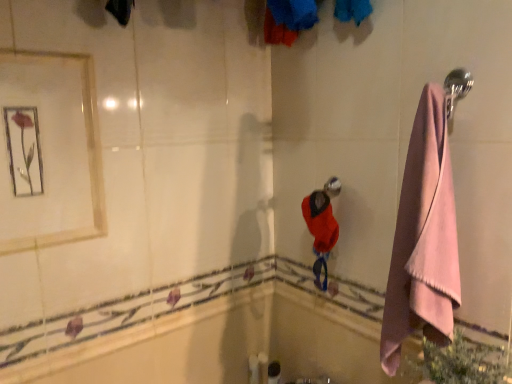
Identify the location of metallic framed mirror at upper left. Image resolution: width=512 pixels, height=384 pixels. point(49,151).

What do you see at coordinates (227, 344) in the screenshot?
I see `white glossy bath at lower left` at bounding box center [227, 344].

At what (x,y) coordinates should I click in order to perform the action: click on metallic framed mirror at upper left. Please return your answer as a coordinate pair (x, y). Looking at the image, I should click on (49, 151).

How distant is satin silver shower head at center from pink fabric towel at right?

They are 16.83 inches apart.

Is satin silver shower head at center bigger or smaller than pink fabric towel at right?

In the image, satin silver shower head at center appears to be smaller than pink fabric towel at right.

This screenshot has height=384, width=512. I want to click on shower behind the pink fabric towel at right, so tap(332, 187).

What's the angular difference between satin silver shower head at center and pink fabric towel at right's facing directions?

The angle between the facing direction of satin silver shower head at center and the facing direction of pink fabric towel at right is 0.546 degrees.

Which object is further away from the camera, metallic framed mirror at upper left or white glossy bath at lower left?

Positioned behind is white glossy bath at lower left.

Is metallic framed mirror at upper left oriented towards white glossy bath at lower left?

No, metallic framed mirror at upper left is not oriented towards white glossy bath at lower left.

Between metallic framed mirror at upper left and white glossy bath at lower left, which one has smaller width?

white glossy bath at lower left is thinner.

From the picture: Considering the relative positions of white glossy bath at lower left and metallic framed mirror at upper left in the image provided, is white glossy bath at lower left to the left of metallic framed mirror at upper left from the viewer's perspective?

No.

Considering the positions of points (230, 362) and (65, 131), is point (230, 362) farther from camera compared to point (65, 131)?

Yes, it is.

Is white glossy bath at lower left shorter than metallic framed mirror at upper left?

Yes.

From a real-world perspective, between white glossy bath at lower left and metallic framed mirror at upper left, who is vertically lower?

From a 3D spatial view, white glossy bath at lower left is below.

Based on the photo, can you see pink fabric towel at right touching metallic framed mirror at upper left?

pink fabric towel at right and metallic framed mirror at upper left are not in contact.

Considering the sizes of objects pink fabric towel at right and metallic framed mirror at upper left in the image provided, who is smaller, pink fabric towel at right or metallic framed mirror at upper left?

metallic framed mirror at upper left is smaller.

Is pink fabric towel at right inside or outside of metallic framed mirror at upper left?

pink fabric towel at right cannot be found inside metallic framed mirror at upper left.

Considering the sizes of satin silver shower head at center and white glossy bath at lower left in the image, is satin silver shower head at center wider or thinner than white glossy bath at lower left?

In the image, satin silver shower head at center appears to be wider than white glossy bath at lower left.

Based on their sizes in the image, would you say satin silver shower head at center is bigger or smaller than white glossy bath at lower left?

Clearly, satin silver shower head at center is smaller in size than white glossy bath at lower left.

Which is closer to the camera, (339, 189) or (244, 330)?

The point (339, 189) is more forward.

From the image's perspective, is white glossy bath at lower left below pink fabric towel at right?

Yes, from the image's perspective, white glossy bath at lower left is below pink fabric towel at right.

Could you tell me if white glossy bath at lower left is turned towards pink fabric towel at right?

No, white glossy bath at lower left does not turn towards pink fabric towel at right.

Based on the photo, from a real-world perspective, is white glossy bath at lower left below pink fabric towel at right?

Yes, from a real-world perspective, white glossy bath at lower left is below pink fabric towel at right.

Are metallic framed mirror at upper left and satin silver shower head at center far apart?

Actually, metallic framed mirror at upper left and satin silver shower head at center are a little close together.

Considering the relative sizes of metallic framed mirror at upper left and satin silver shower head at center in the image provided, is metallic framed mirror at upper left shorter than satin silver shower head at center?

In fact, metallic framed mirror at upper left may be taller than satin silver shower head at center.

Based on the photo, in the image, is metallic framed mirror at upper left on the left side or the right side of satin silver shower head at center?

Based on their positions, metallic framed mirror at upper left is located to the left of satin silver shower head at center.

Which is in front, point (65, 230) or point (339, 189)?

Point (65, 230)

At what (x,y) coordinates should I click in order to perform the action: click on shower that is above the pink fabric towel at right (from a real-world perspective). Please return your answer as a coordinate pair (x, y). Image resolution: width=512 pixels, height=384 pixels. Looking at the image, I should click on (332, 187).

Find the location of a particular element. This screenshot has width=512, height=384. bath below the metallic framed mirror at upper left (from the image's perspective) is located at coordinates (227, 344).

From the image, which object appears to be farther from white glossy bath at lower left, metallic framed mirror at upper left or pink fabric towel at right?

metallic framed mirror at upper left.

Which object lies nearer to the anchor point satin silver shower head at center, metallic framed mirror at upper left or white glossy bath at lower left?

white glossy bath at lower left.

Looking at the image, which one is located further to pink fabric towel at right, metallic framed mirror at upper left or white glossy bath at lower left?

Based on the image, metallic framed mirror at upper left appears to be further to pink fabric towel at right.

Looking at the image, which one is located closer to satin silver shower head at center, pink fabric towel at right or metallic framed mirror at upper left?

Among the two, pink fabric towel at right is located nearer to satin silver shower head at center.

From the image, which object appears to be farther from white glossy bath at lower left, pink fabric towel at right or satin silver shower head at center?

Among the two, satin silver shower head at center is located further to white glossy bath at lower left.

When comparing their distances from metallic framed mirror at upper left, does pink fabric towel at right or white glossy bath at lower left seem closer?

The object closer to metallic framed mirror at upper left is white glossy bath at lower left.

Estimate the real-world distances between objects in this image. Which object is further from pink fabric towel at right, white glossy bath at lower left or metallic framed mirror at upper left?

The object further to pink fabric towel at right is metallic framed mirror at upper left.

Looking at this image, considering their positions, is satin silver shower head at center positioned further to metallic framed mirror at upper left than pink fabric towel at right?

pink fabric towel at right lies further to metallic framed mirror at upper left than the other object.

Locate an element on the screen. This screenshot has width=512, height=384. bath between metallic framed mirror at upper left and satin silver shower head at center is located at coordinates (227, 344).

Find the location of a particular element. The height and width of the screenshot is (384, 512). shower between metallic framed mirror at upper left and pink fabric towel at right is located at coordinates pyautogui.click(x=332, y=187).

Where is `shower located between white glossy bath at lower left and pink fabric towel at right in the left-right direction`? This screenshot has height=384, width=512. shower located between white glossy bath at lower left and pink fabric towel at right in the left-right direction is located at coordinates (332, 187).

Locate an element on the screen. The width and height of the screenshot is (512, 384). bath between metallic framed mirror at upper left and pink fabric towel at right is located at coordinates (227, 344).